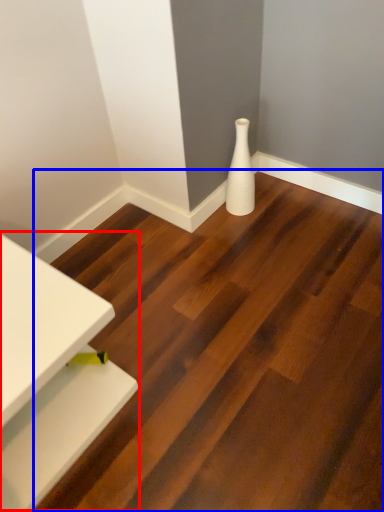
Question: Which point is closer to the camera, table (highlighted by a red box) or stair (highlighted by a blue box)?

Choices:
 (A) table
 (B) stair

Answer: (B)